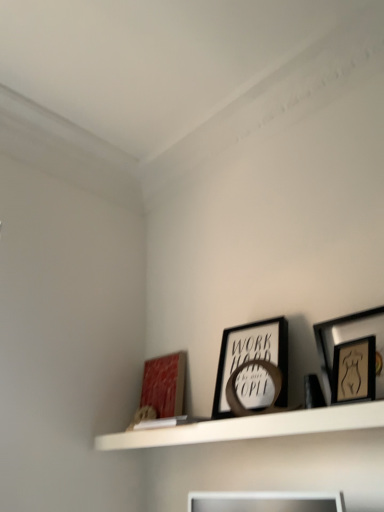
Question: Visually, is black matte picture frame at center, the second picture frame when ordered from right to left, positioned to the left or to the right of wooden framed artwork at upper right, which ranks as the 3th picture frame in left-to-right order?

Choices:
 (A) right
 (B) left

Answer: (B)

Question: Relative to wooden framed artwork at upper right, which ranks as the 3th picture frame in left-to-right order, is black matte picture frame at center, which is the second picture frame from front to back, in front or behind?

Choices:
 (A) behind
 (B) front

Answer: (A)

Question: Which object is the closest to the matte red picture frame at lower left, the first picture frame viewed from the left?

Choices:
 (A) black matte picture frame at center, the second picture frame when ordered from right to left
 (B) wooden framed artwork at upper right, which ranks as the first picture frame in front-to-back order
 (C) white matte shelf at upper center

Answer: (C)

Question: Which of these objects is positioned closest to the black matte picture frame at center, marked as the second picture frame in a left-to-right arrangement?

Choices:
 (A) white matte shelf at upper center
 (B) wooden framed artwork at upper right, marked as the first picture frame in a right-to-left arrangement
 (C) matte red picture frame at lower left, the third picture frame viewed from the front

Answer: (A)